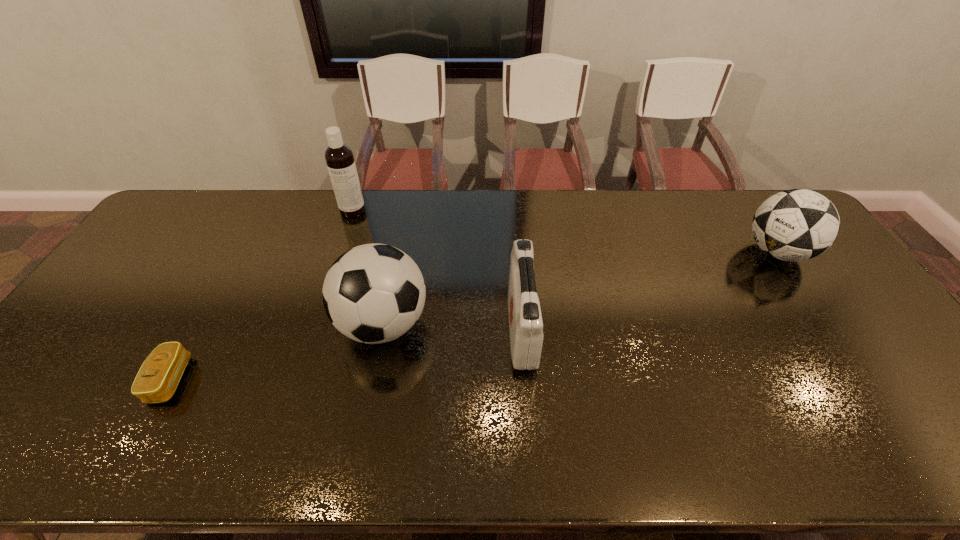
Where is `empty space between the leftmost object and the third object from left to right`? The height and width of the screenshot is (540, 960). empty space between the leftmost object and the third object from left to right is located at coordinates (276, 352).

The height and width of the screenshot is (540, 960). Identify the location of empty location between the first-aid kit and the farthest object. (437, 270).

Find the location of `vacant space that's between the tallest object and the first-aid kit`. vacant space that's between the tallest object and the first-aid kit is located at coordinates (437, 270).

In order to click on free space between the fourth object from left to right and the shorter soccer ball in this screenshot , I will do `click(649, 291)`.

This screenshot has width=960, height=540. What are the coordinates of `free space that is in between the shortest object and the fourth object from left to right` in the screenshot? It's located at (347, 354).

Identify the location of unoccupied position between the shorter soccer ball and the left soccer ball. (580, 288).

Identify the location of empty space between the third object from right to left and the second object from right to left. click(x=452, y=327).

At what (x,y) coordinates should I click in order to perform the action: click on unoccupied position between the leftmost object and the fourth object from left to right. Please return your answer as a coordinate pair (x, y). The width and height of the screenshot is (960, 540). Looking at the image, I should click on (347, 354).

You are a GUI agent. You are given a task and a screenshot of the screen. Output one action in this format:
    pyautogui.click(x=<x>, y=<y>)
    Task: Click on the third closest object to the left soccer ball
    The image size is (960, 540).
    Given the screenshot: What is the action you would take?
    pyautogui.click(x=339, y=157)

This screenshot has width=960, height=540. What are the coordinates of `the closest object relative to the farther soccer ball` in the screenshot? It's located at (x=526, y=336).